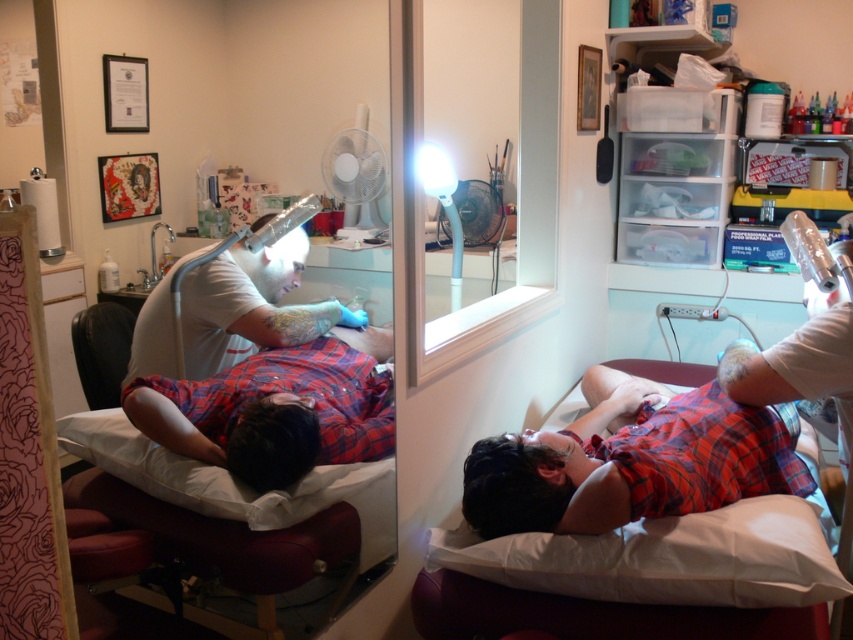
You are a customer in the tattoo studio and want to know if the matte white lamp at upper left is positioned above the red plaid shirt at lower right. Can you confirm this based on the scene?

Yes, the matte white lamp at upper left is located above the red plaid shirt at lower right according to the description.

You are standing in the tattoo studio and want to touch the point at coordinates (x=691, y=600). Is this point within your reach if you can extend your arm 1.2 meters?

The point at coordinates (x=691, y=600) is 1.33 meters away from the viewer. Since your arm can only extend 1.2 meters, you cannot reach it.